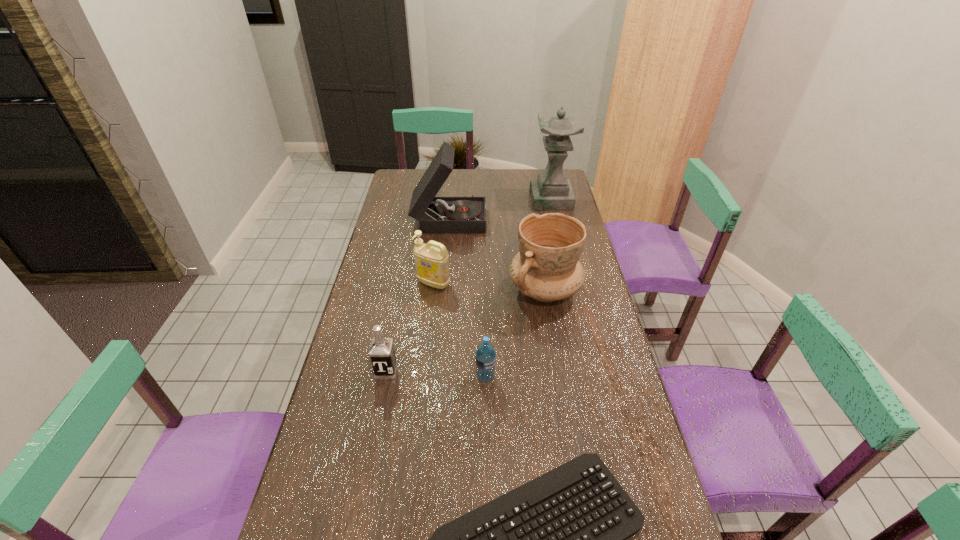
At what (x,y) coordinates should I click in order to perform the action: click on free space located 0.050m on the back of the pottery. Please return your answer as a coordinate pair (x, y). This screenshot has width=960, height=540. Looking at the image, I should click on pyautogui.click(x=540, y=259).

Identify the location of free space located 0.310m on the front of the detergent. Image resolution: width=960 pixels, height=540 pixels. (424, 364).

This screenshot has height=540, width=960. What are the coordinates of `vacant space situated 0.220m on the front label of the vodka` in the screenshot? It's located at (371, 453).

Find the location of a particular element. The height and width of the screenshot is (540, 960). free point located on the right of the water bottle is located at coordinates (600, 377).

Locate an element on the screen. object present at the far edge is located at coordinates (551, 190).

This screenshot has height=540, width=960. I want to click on phonograph_record present at the left edge, so click(465, 214).

The width and height of the screenshot is (960, 540). What are the coordinates of `vodka that is positioned at the left edge` in the screenshot? It's located at (381, 352).

Identify the location of sculpture at the right edge. The image size is (960, 540). (551, 190).

Image resolution: width=960 pixels, height=540 pixels. Identify the location of pottery at the right edge. 547,268.

I want to click on object that is at the far right corner, so click(x=551, y=190).